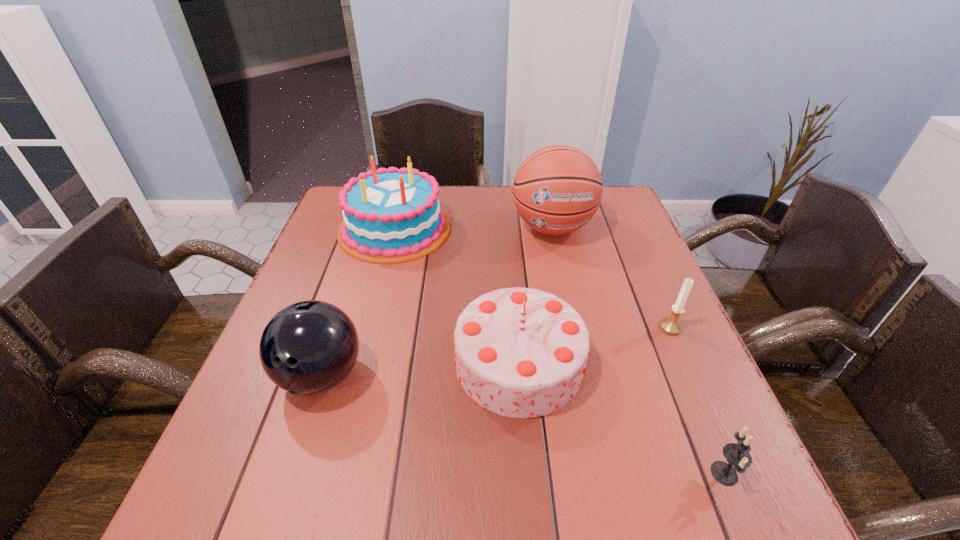
The width and height of the screenshot is (960, 540). Identify the location of vacant area located 0.110m on the back of the right birthday cake. (513, 282).

In order to click on free spot located 0.050m on the side of the bowling ball with the finger holes in this screenshot , I will do `click(300, 440)`.

I want to click on free location located 0.400m on the back of the fifth tallest object, so click(x=623, y=219).

What are the coordinates of `vacant space located on the back of the nearest object` in the screenshot? It's located at (656, 310).

At what (x,y) coordinates should I click in order to perform the action: click on basketball that is at the far edge. Please return your answer as a coordinate pair (x, y). The image size is (960, 540). Looking at the image, I should click on (557, 190).

At what (x,y) coordinates should I click in order to perform the action: click on birthday cake that is at the far edge. Please return your answer as a coordinate pair (x, y). The width and height of the screenshot is (960, 540). Looking at the image, I should click on (391, 215).

Where is `object situated at the near edge`? This screenshot has height=540, width=960. object situated at the near edge is located at coordinates (737, 455).

Where is `birthday cake that is positioned at the left edge`? This screenshot has width=960, height=540. birthday cake that is positioned at the left edge is located at coordinates (391, 215).

Find the location of a particular element. The height and width of the screenshot is (540, 960). bowling ball present at the left edge is located at coordinates (309, 347).

Where is `basketball that is at the right edge`? The width and height of the screenshot is (960, 540). basketball that is at the right edge is located at coordinates (557, 190).